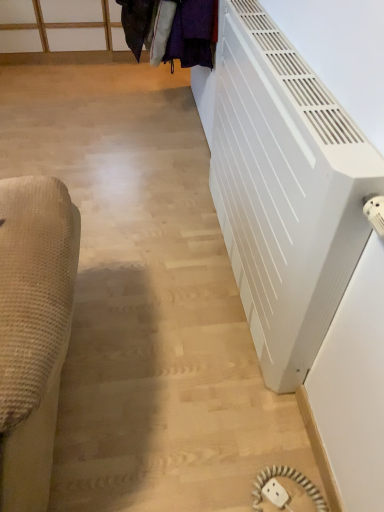
Question: Is white matte radiator at right located within white plastic outlet at lower right?

Choices:
 (A) no
 (B) yes

Answer: (A)

Question: Is the position of white plastic outlet at lower right less distant than that of white matte radiator at right?

Choices:
 (A) yes
 (B) no

Answer: (B)

Question: Would you say white plastic outlet at lower right is a long distance from white matte radiator at right?

Choices:
 (A) yes
 (B) no

Answer: (B)

Question: From a real-world perspective, is white plastic outlet at lower right under white matte radiator at right?

Choices:
 (A) no
 (B) yes

Answer: (B)

Question: Can you confirm if white plastic outlet at lower right is shorter than white matte radiator at right?

Choices:
 (A) yes
 (B) no

Answer: (A)

Question: Considering their positions, is white matte radiator at right located in front of or behind velvet purple coat at upper center?

Choices:
 (A) behind
 (B) front

Answer: (B)

Question: Looking at their shapes, would you say white matte radiator at right is wider or thinner than velvet purple coat at upper center?

Choices:
 (A) wide
 (B) thin

Answer: (B)

Question: Which is correct: white matte radiator at right is inside velvet purple coat at upper center, or outside of it?

Choices:
 (A) inside
 (B) outside

Answer: (B)

Question: From the image's perspective, is white matte radiator at right positioned above or below velvet purple coat at upper center?

Choices:
 (A) above
 (B) below

Answer: (B)

Question: Considering their positions, is white plastic outlet at lower right located in front of or behind velvet purple coat at upper center?

Choices:
 (A) behind
 (B) front

Answer: (B)

Question: Would you say white plastic outlet at lower right is to the left or to the right of velvet purple coat at upper center in the picture?

Choices:
 (A) right
 (B) left

Answer: (A)

Question: Choose the correct answer: Is white plastic outlet at lower right inside velvet purple coat at upper center or outside it?

Choices:
 (A) outside
 (B) inside

Answer: (A)

Question: Looking at their shapes, would you say white plastic outlet at lower right is wider or thinner than velvet purple coat at upper center?

Choices:
 (A) wide
 (B) thin

Answer: (B)

Question: Is velvet purple coat at upper center to the left or to the right of white matte radiator at right in the image?

Choices:
 (A) left
 (B) right

Answer: (A)

Question: Is velvet purple coat at upper center inside the boundaries of white matte radiator at right, or outside?

Choices:
 (A) outside
 (B) inside

Answer: (A)